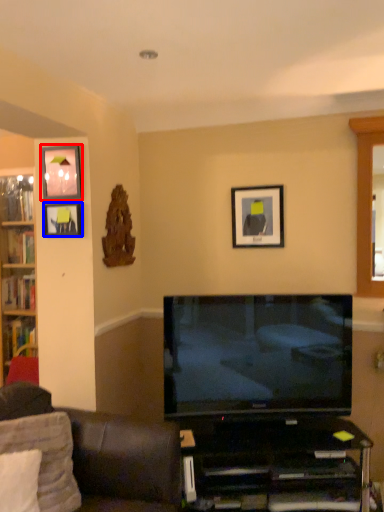
Question: Which object is closer to the camera taking this photo, picture frame (highlighted by a red box) or picture frame (highlighted by a blue box)?

Choices:
 (A) picture frame
 (B) picture frame

Answer: (A)